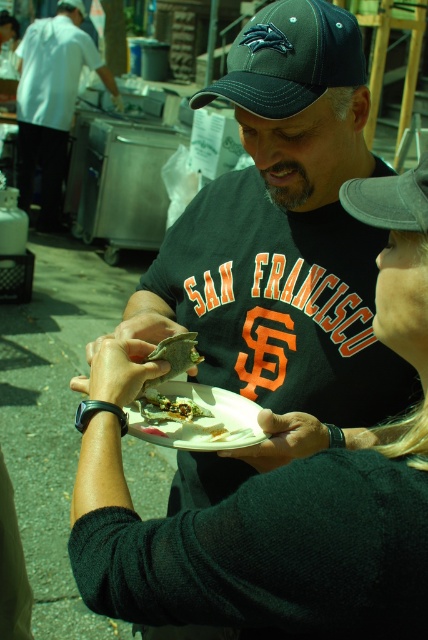
Does white paper plate at center have a lesser height compared to gray suede baseball cap at upper center?

Correct, white paper plate at center is not as tall as gray suede baseball cap at upper center.

Is point (166, 396) positioned behind point (351, 192)?

Yes, point (166, 396) is behind point (351, 192).

This screenshot has height=640, width=428. I want to click on white paper plate at center, so click(x=201, y=419).

Is black fabric baseball cap at upper center to the left of gray suede baseball cap at upper center from the viewer's perspective?

Correct, you'll find black fabric baseball cap at upper center to the left of gray suede baseball cap at upper center.

Between point (290, 84) and point (385, 193), which one is positioned in front?

Point (385, 193) is more forward.

Based on the photo, who is more distant from viewer, (216, 93) or (382, 208)?

The point (216, 93) is behind.

The image size is (428, 640). In order to click on black fabric baseball cap at upper center in this screenshot , I will do `click(288, 58)`.

Is black fabric baseball cap at upper center smaller than matte black shirt at center?

Correct, black fabric baseball cap at upper center occupies less space than matte black shirt at center.

Describe the element at coordinates (288, 58) in the screenshot. I see `black fabric baseball cap at upper center` at that location.

Does point (259, 29) come closer to viewer compared to point (38, 116)?

Yes, it is in front of point (38, 116).

Locate an element on the screen. black fabric baseball cap at upper center is located at coordinates (288, 58).